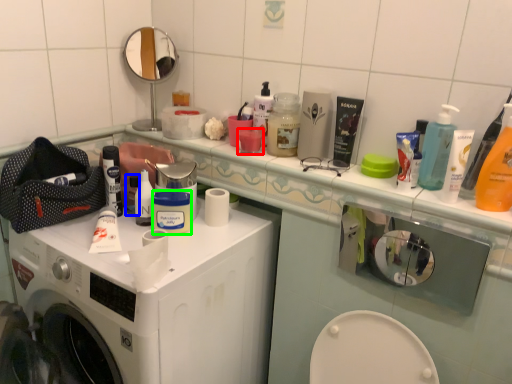
Question: Which object is positioned farthest from mouthwash (highlighted by a red box)? Select from toiletry (highlighted by a blue box) and mouthwash (highlighted by a green box).

Choices:
 (A) toiletry
 (B) mouthwash

Answer: (A)